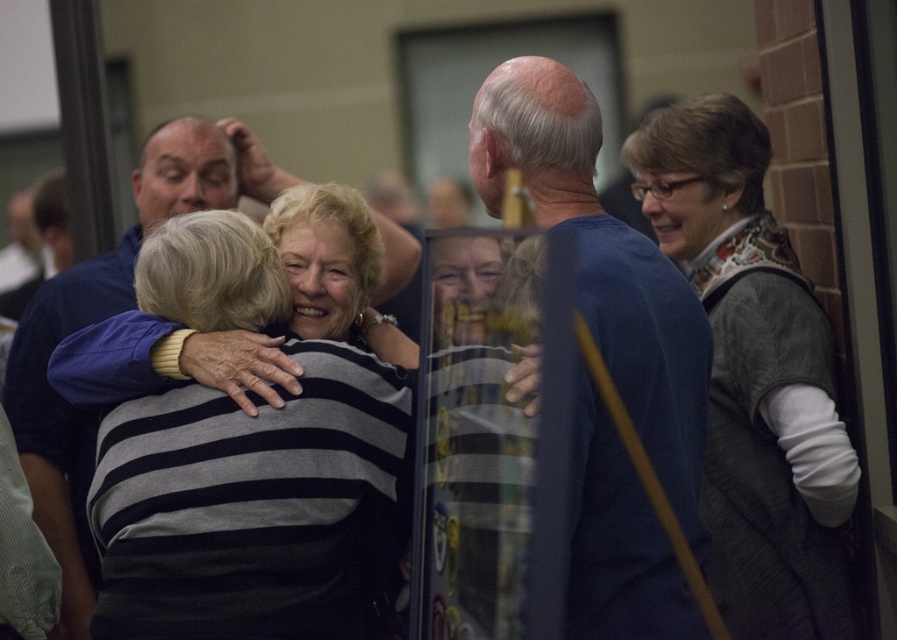
Question: Among these points, which one is farthest from the camera?

Choices:
 (A) (392, 480)
 (B) (519, 392)
 (C) (834, 419)

Answer: (C)

Question: Can you confirm if knitted gray vest at right is positioned above blue fabric shirt at center?

Choices:
 (A) no
 (B) yes

Answer: (A)

Question: Based on their relative distances, which object is nearer to the knitted gray vest at right?

Choices:
 (A) striped fabric sweater at center
 (B) blue fabric shirt at center

Answer: (B)

Question: Can you confirm if knitted gray vest at right is thinner than blue fabric shirt at center?

Choices:
 (A) no
 (B) yes

Answer: (B)

Question: Which point appears farthest from the camera in this image?

Choices:
 (A) (704, 152)
 (B) (277, 412)

Answer: (A)

Question: Considering the relative positions of striped fabric sweater at center and knitted gray vest at right in the image provided, where is striped fabric sweater at center located with respect to knitted gray vest at right?

Choices:
 (A) below
 (B) above

Answer: (A)